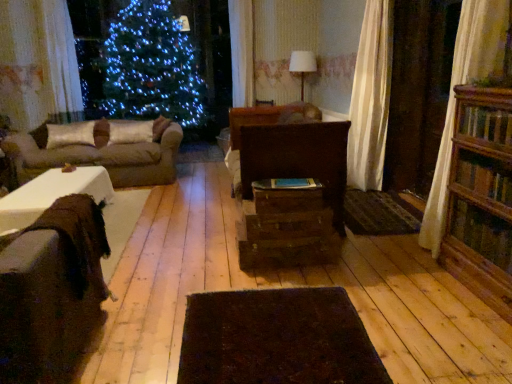
Identify the location of vacant space that is in between wooden bookcase at right and brown fuzzy studio couch at left, the 2th studio couch in the top-to-bottom sequence. (297, 318).